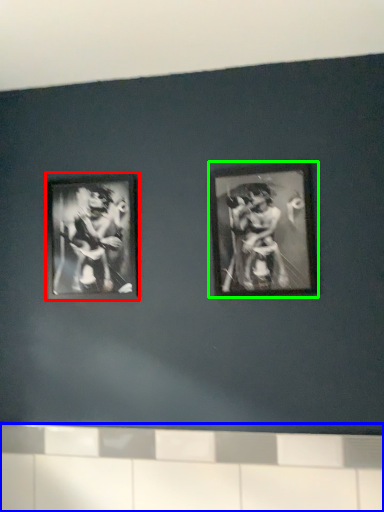
Question: Which object is positioned farthest from picture frame (highlighted by a red box)? Select from ledge (highlighted by a blue box) and picture frame (highlighted by a green box).

Choices:
 (A) ledge
 (B) picture frame

Answer: (A)